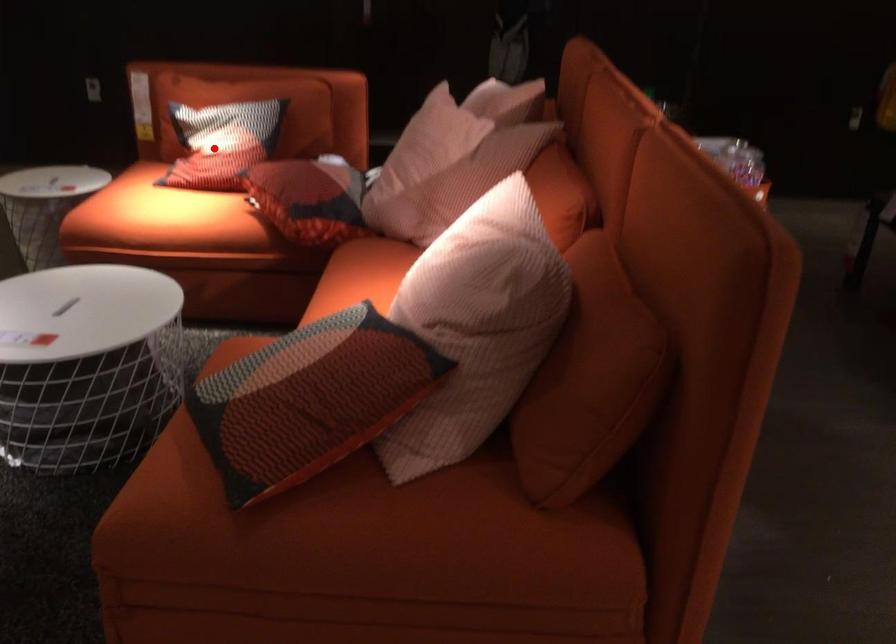
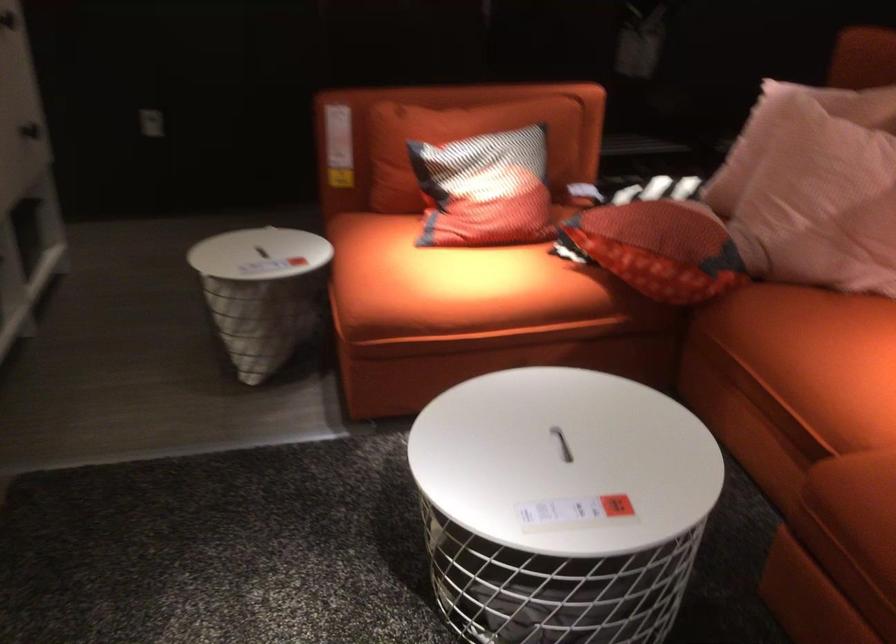
Locate, in the second image, the point that corresponds to the highlighted location in the first image.

(485, 190)